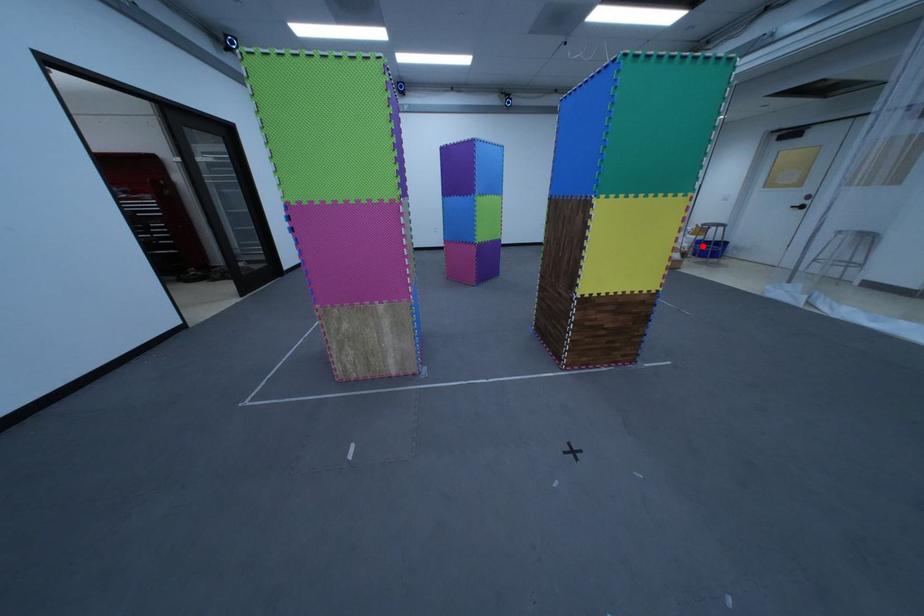
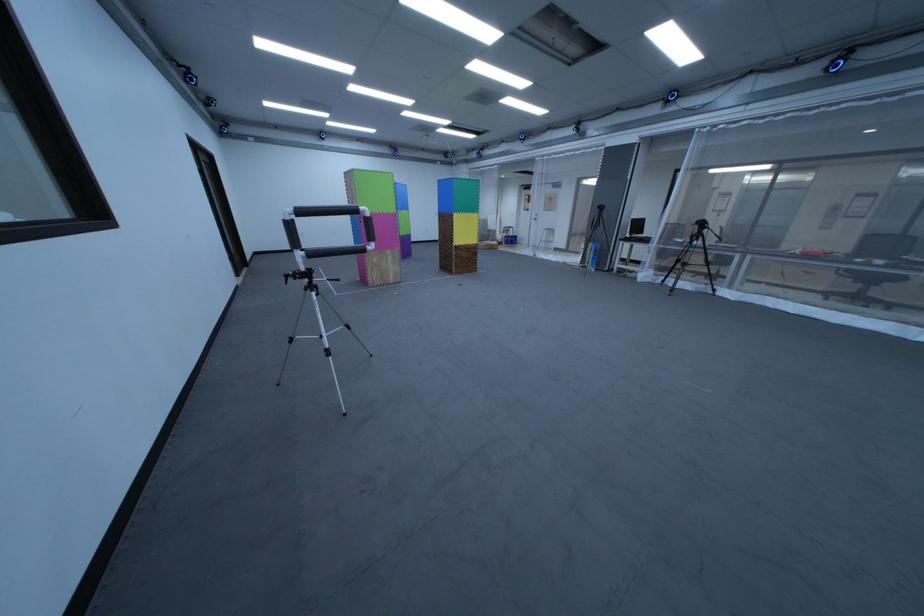
Question: A red point is marked in image1. In image2, is the corresponding 3D point closer to the camera or farther? Reply with the corresponding letter.

Choices:
 (A) The corresponding 3D point is closer.
 (B) The corresponding 3D point is farther.

Answer: (A)